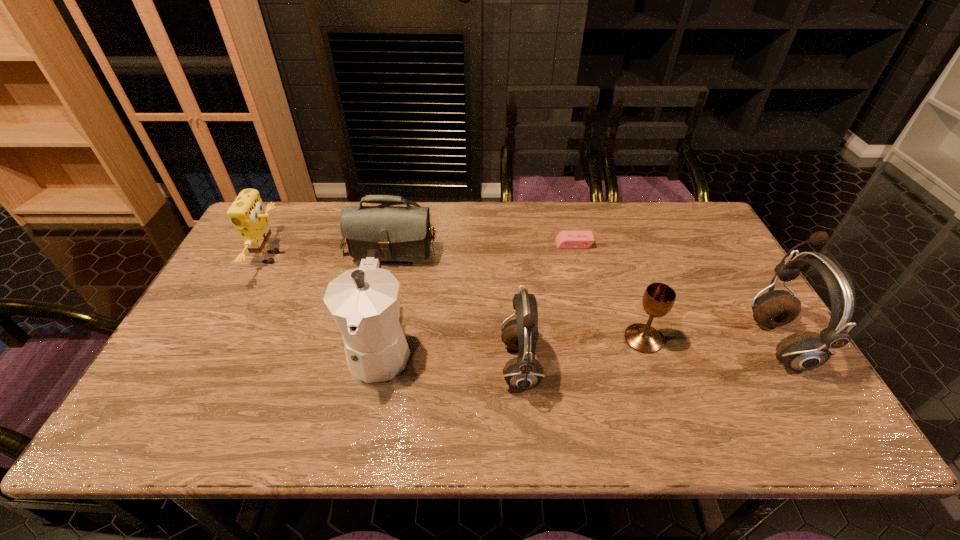
Locate an element on the screen. vacant space at the right edge of the desktop is located at coordinates (743, 358).

The width and height of the screenshot is (960, 540). In order to click on vacant space at the near left corner of the desktop in this screenshot , I will do `click(210, 384)`.

In the image, there is a desktop. Identify the location of vacant space at the far right corner. (656, 202).

At what (x,y) coordinates should I click in order to perform the action: click on free spot between the coffeepot and the third object from right to left. Please return your answer as a coordinate pair (x, y). This screenshot has width=960, height=540. Looking at the image, I should click on (477, 296).

At what (x,y) coordinates should I click in order to perform the action: click on free area in between the fifth object from left to right and the second shortest object. Please return your answer as a coordinate pair (x, y). Looking at the image, I should click on (609, 292).

The image size is (960, 540). I want to click on free point between the shoulder bag and the taller earphone, so click(586, 288).

Find the location of a particular element. Image resolution: width=960 pixels, height=540 pixels. vacant space that's between the fifth object from left to right and the shorter earphone is located at coordinates [x=547, y=306].

Locate an element on the screen. The width and height of the screenshot is (960, 540). vacant area that lies between the rightmost object and the fourth object from right to left is located at coordinates (649, 354).

Identify the location of free area in between the shorter earphone and the sixth object from left to right. The width and height of the screenshot is (960, 540). (582, 353).

Locate an element on the screen. Image resolution: width=960 pixels, height=540 pixels. free space between the shortest object and the coffeepot is located at coordinates (477, 296).